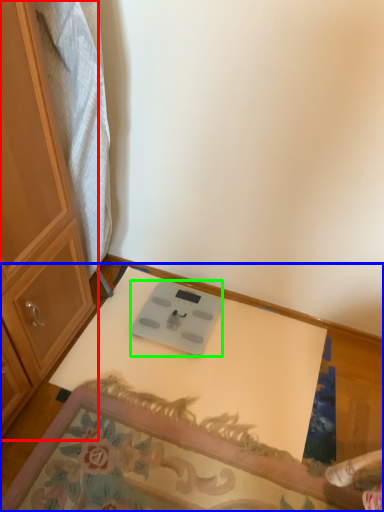
Question: Which is farther away from cabinetry (highlighted by a red box)? table (highlighted by a blue box) or weight scale (highlighted by a green box)?

Choices:
 (A) table
 (B) weight scale

Answer: (A)